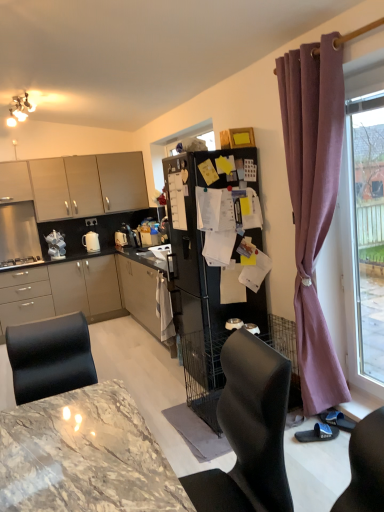
Image resolution: width=384 pixels, height=512 pixels. Describe the element at coordinates (204, 277) in the screenshot. I see `black matte refrigerator at center` at that location.

In order to face matte beige cabinets at upper left, which is the first cabinetry from top to bottom, should I rotate leftwards or rightwards?

Rotate your view left by about 13.535°.

This screenshot has height=512, width=384. Find the location of `white glossy electric kettle at center, which is the third appliance in left-to-right order`. white glossy electric kettle at center, which is the third appliance in left-to-right order is located at coordinates (x=91, y=242).

You are a GUI agent. You are given a task and a screenshot of the screen. Output one action in this format:
    pyautogui.click(x=<x>, y=<y>)
    Task: Click on the purple fabric curtain at right
    The height and width of the screenshot is (512, 384).
    Given the screenshot: What is the action you would take?
    pyautogui.click(x=313, y=202)

The width and height of the screenshot is (384, 512). Describe the element at coordinates (313, 202) in the screenshot. I see `purple fabric curtain at right` at that location.

The width and height of the screenshot is (384, 512). In order to click on black matte refrigerator at center in this screenshot , I will do `click(204, 277)`.

Is matte white cabinet at upper left, acting as the 2th cabinetry starting from the bottom, in front of or behind black matte refrigerator at center in the image?

In the image, matte white cabinet at upper left, acting as the 2th cabinetry starting from the bottom, appears behind black matte refrigerator at center.

Considering the sizes of objects matte white cabinet at upper left, acting as the 2th cabinetry starting from the bottom, and black matte refrigerator at center in the image provided, who is smaller, matte white cabinet at upper left, acting as the 2th cabinetry starting from the bottom, or black matte refrigerator at center?

matte white cabinet at upper left, acting as the 2th cabinetry starting from the bottom, is smaller.

From the image's perspective, is matte white cabinet at upper left, acting as the 2th cabinetry starting from the bottom, located above or below black matte refrigerator at center?

From the image's perspective, matte white cabinet at upper left, acting as the 2th cabinetry starting from the bottom, appears above black matte refrigerator at center.

From a real-world perspective, relative to black matte refrigerator at center, is matte white cabinet at upper left, acting as the 2th cabinetry starting from the bottom, vertically above or below?

Clearly, from a real-world perspective, matte white cabinet at upper left, acting as the 2th cabinetry starting from the bottom, is above black matte refrigerator at center.

From the image's perspective, is matte gray cabinets at left, the third cabinetry positioned from the top, located above or below matte beige cabinets at upper left, which is the first cabinetry from top to bottom?

Based on their image positions, matte gray cabinets at left, the third cabinetry positioned from the top, is located beneath matte beige cabinets at upper left, which is the first cabinetry from top to bottom.

From a real-world perspective, is matte gray cabinets at left, the third cabinetry positioned from the top, above or below matte beige cabinets at upper left, positioned as the 3th cabinetry in bottom-to-top order?

matte gray cabinets at left, the third cabinetry positioned from the top, is below matte beige cabinets at upper left, positioned as the 3th cabinetry in bottom-to-top order.

This screenshot has width=384, height=512. What are the coordinates of `the 2nd cabinetry behind the matte gray cabinets at left, the third cabinetry positioned from the top` in the screenshot? It's located at (77, 184).

Is white glossy kettle at left, which ranks as the 2th appliance in left-to-right order, inside pink fabric curtain at right?

Definitely not — white glossy kettle at left, which ranks as the 2th appliance in left-to-right order, is not inside pink fabric curtain at right.

Between pink fabric curtain at right and white glossy kettle at left, the second appliance positioned from the right, which one is positioned behind?

white glossy kettle at left, the second appliance positioned from the right.

Is pink fabric curtain at right turned away from white glossy kettle at left, the second appliance positioned from the right?

No, pink fabric curtain at right is not facing the opposite direction of white glossy kettle at left, the second appliance positioned from the right.

Locate an element on the screen. This screenshot has height=512, width=384. window that is below the white glossy kettle at left, which ranks as the 2th appliance in left-to-right order (from the image's perspective) is located at coordinates (360, 266).

Considering the positions of points (347, 346) and (96, 250), is point (347, 346) closer to camera compared to point (96, 250)?

Yes, point (347, 346) is closer to viewer.

Can you confirm if pink fabric curtain at right is thinner than white glossy electric kettle at center, which is the 1th appliance from right to left?

Indeed, pink fabric curtain at right has a lesser width compared to white glossy electric kettle at center, which is the 1th appliance from right to left.

From the image's perspective, which object appears higher, pink fabric curtain at right or white glossy electric kettle at center, which is the third appliance in left-to-right order?

white glossy electric kettle at center, which is the third appliance in left-to-right order, is shown above in the image.

From the image's perspective, is matte beige cabinets at upper left, positioned as the 3th cabinetry in bottom-to-top order, positioned above or below purple fabric curtain at right?

matte beige cabinets at upper left, positioned as the 3th cabinetry in bottom-to-top order, is above purple fabric curtain at right.

How far apart are matte beige cabinets at upper left, which is the first cabinetry from top to bottom, and purple fabric curtain at right?

A distance of 3.82 meters exists between matte beige cabinets at upper left, which is the first cabinetry from top to bottom, and purple fabric curtain at right.

Does matte beige cabinets at upper left, which is the first cabinetry from top to bottom, have a lesser width compared to purple fabric curtain at right?

No, matte beige cabinets at upper left, which is the first cabinetry from top to bottom, is not thinner than purple fabric curtain at right.

How many degrees apart are the facing directions of matte beige cabinets at upper left, positioned as the 3th cabinetry in bottom-to-top order, and purple fabric curtain at right?

The angle between the facing direction of matte beige cabinets at upper left, positioned as the 3th cabinetry in bottom-to-top order, and the facing direction of purple fabric curtain at right is 85.8 degrees.

From the picture: How different are the orientations of black matte refrigerator at center and brushed metal oven at left, the first appliance in the left-to-right sequence, in degrees?

88.7 degrees.

Which is farther, [241,150] or [4,263]?

The point [4,263] is farther from the camera.

Is black matte refrigerator at center further to camera compared to brushed metal oven at left, the first appliance in the left-to-right sequence?

No, black matte refrigerator at center is closer to the camera.

Identify the location of refrigerator on the right side of matte gray cabinets at left, the third cabinetry positioned from the top. (204, 277).

From a real-world perspective, which object rests below the other?

matte gray cabinets at left, the third cabinetry positioned from the top.

Who is smaller, matte gray cabinets at left, which is the first cabinetry from bottom to top, or black matte refrigerator at center?

With smaller size is black matte refrigerator at center.

From the image's perspective, is matte gray cabinets at left, which is the first cabinetry from bottom to top, above or below black matte refrigerator at center?

matte gray cabinets at left, which is the first cabinetry from bottom to top, is below black matte refrigerator at center.

This screenshot has width=384, height=512. In the image, there is a matte white cabinet at upper left, the second cabinetry from the top. What are the coordinates of `refrigerator below it (from a real-world perspective)` in the screenshot? It's located at (x=204, y=277).

Which cabinetry is the 1st one when counting from the left side of the matte beige cabinets at upper left, which is the first cabinetry from top to bottom? Please provide its 2D coordinates.

[(84, 292)]

Estimate the real-world distances between objects in this image. Which object is closer to black matte refrigerator at center, brushed metal oven at left, marked as the 3th appliance in a right-to-left arrangement, or pink fabric curtain at right?

Among the two, pink fabric curtain at right is located nearer to black matte refrigerator at center.

Based on their spatial positions, is purple fabric curtain at right or brushed metal oven at left, the first appliance in the left-to-right sequence, closer to black matte refrigerator at center?

Based on the image, purple fabric curtain at right appears to be nearer to black matte refrigerator at center.

When comparing their distances from matte gray cabinets at left, which is the first cabinetry from bottom to top, does white glossy kettle at left, which ranks as the 2th appliance in left-to-right order, or matte beige cabinets at upper left, which is the first cabinetry from top to bottom, seem closer?

white glossy kettle at left, which ranks as the 2th appliance in left-to-right order.

Considering their positions, is matte white cabinet at upper left, acting as the 2th cabinetry starting from the bottom, positioned further to black matte refrigerator at center than matte beige cabinets at upper left, positioned as the 3th cabinetry in bottom-to-top order?

matte white cabinet at upper left, acting as the 2th cabinetry starting from the bottom, is further to black matte refrigerator at center.

Looking at this image, which object lies nearer to the anchor point brushed metal oven at left, marked as the 3th appliance in a right-to-left arrangement, white glossy kettle at left, the second appliance positioned from the right, or matte gray cabinets at left, the third cabinetry positioned from the top?

white glossy kettle at left, the second appliance positioned from the right.

Looking at the image, which one is located further to matte gray cabinets at left, which is the first cabinetry from bottom to top, white glossy kettle at left, which ranks as the 2th appliance in left-to-right order, or white glossy electric kettle at center, which is the 1th appliance from right to left?

white glossy electric kettle at center, which is the 1th appliance from right to left, is further to matte gray cabinets at left, which is the first cabinetry from bottom to top.

Looking at the image, which one is located closer to black matte refrigerator at center, white glossy kettle at left, the second appliance positioned from the right, or pink fabric curtain at right?

pink fabric curtain at right is closer to black matte refrigerator at center.

Considering their positions, is matte gray cabinets at left, which is the first cabinetry from bottom to top, positioned further to matte beige cabinets at upper left, positioned as the 3th cabinetry in bottom-to-top order, than pink fabric curtain at right?

The object further to matte beige cabinets at upper left, positioned as the 3th cabinetry in bottom-to-top order, is pink fabric curtain at right.

Image resolution: width=384 pixels, height=512 pixels. Find the location of `refrigerator positioned between pink fabric curtain at right and matte beige cabinets at upper left, positioned as the 3th cabinetry in bottom-to-top order, from near to far`. refrigerator positioned between pink fabric curtain at right and matte beige cabinets at upper left, positioned as the 3th cabinetry in bottom-to-top order, from near to far is located at coordinates (204, 277).

This screenshot has height=512, width=384. I want to click on refrigerator between pink fabric curtain at right and matte gray cabinets at left, which is the first cabinetry from bottom to top, from front to back, so click(x=204, y=277).

You are a GUI agent. You are given a task and a screenshot of the screen. Output one action in this format:
    pyautogui.click(x=<x>, y=<y>)
    Task: Click on the window between purple fabric curtain at right and white glossy kettle at left, which ranks as the 2th appliance in left-to-right order, along the z-axis
    Image resolution: width=384 pixels, height=512 pixels.
    Given the screenshot: What is the action you would take?
    pyautogui.click(x=360, y=266)

Locate an element on the screen. The image size is (384, 512). appliance between purple fabric curtain at right and matte beige cabinets at upper left, positioned as the 3th cabinetry in bottom-to-top order, from front to back is located at coordinates (20, 261).